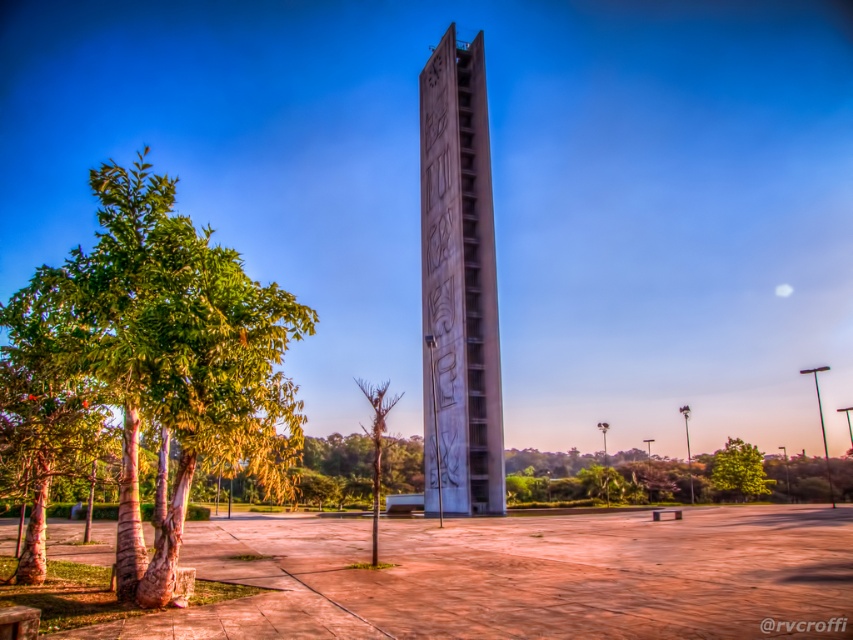
You are standing in the plaza and want to take a photo of both the white concrete tower at center and the green leafy tree at center. Which object should you focus on first if you want to ensure both are in the frame?

You should focus on the white concrete tower at center first because it is larger than the green leafy tree at center, so it will take up more space in the frame and require proper framing first.

You are standing in the plaza and want to take a photo of both the white concrete tower at center and the green leafy tree at center. Which object should you focus on first to ensure both are in frame?

The white concrete tower at center is taller than the green leafy tree at center, so you should focus on the white concrete tower at center first to ensure both are in frame.

You are standing in the plaza and want to take a photo of the white concrete tower at center. There is a green leafy tree at left in the way. Can you see the entire tower without the tree blocking it?

The green leafy tree at left is larger in size than white concrete tower at center, so the tree may block part of the tower depending on their positions. To ensure the entire tower is visible, move to a position where the tree is not between you and the tower.